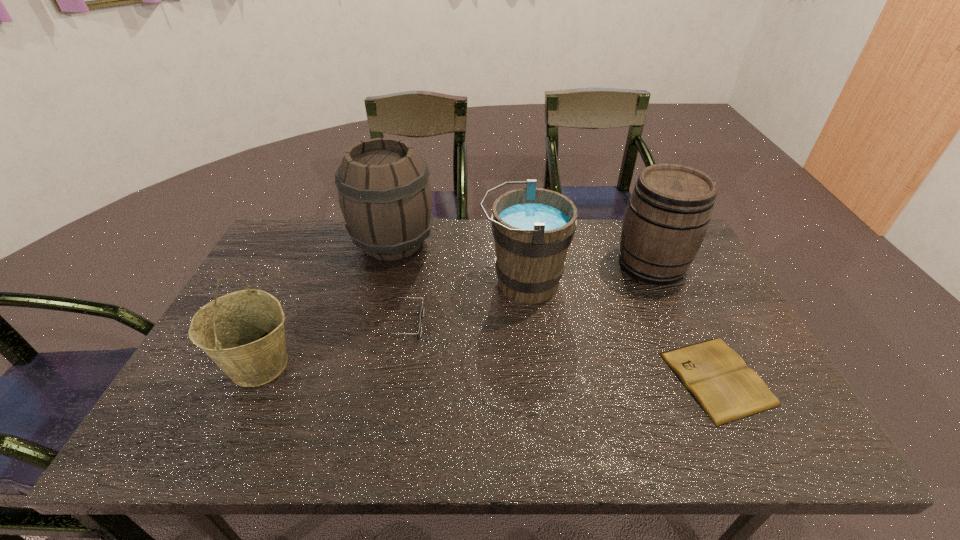
At what (x,y) coordinates should I click in order to perform the action: click on object that is at the near right corner. Please return your answer as a coordinate pair (x, y). Looking at the image, I should click on (718, 378).

Locate an element on the screen. Image resolution: width=960 pixels, height=540 pixels. vacant space at the far edge of the desktop is located at coordinates (467, 258).

What are the coordinates of `vacant space at the near edge of the desktop` in the screenshot? It's located at (398, 454).

In the image, there is a desktop. Identify the location of vacant space at the left edge. Image resolution: width=960 pixels, height=540 pixels. (244, 287).

In the image, there is a desktop. At what (x,y) coordinates should I click in order to perform the action: click on free space at the right edge. Please return your answer as a coordinate pair (x, y). The height and width of the screenshot is (540, 960). Looking at the image, I should click on (684, 298).

Where is `free region at the far left corner`? Image resolution: width=960 pixels, height=540 pixels. free region at the far left corner is located at coordinates (305, 246).

In order to click on free location at the near right corner of the desktop in this screenshot , I will do `click(788, 435)`.

At what (x,y) coordinates should I click in order to perform the action: click on free space between the shortest object and the rightmost wine bucket. Please return your answer as a coordinate pair (x, y). The width and height of the screenshot is (960, 540). Looking at the image, I should click on (684, 321).

Locate an element on the screen. This screenshot has width=960, height=540. blank region between the second shortest object and the leftmost object is located at coordinates (330, 344).

Identify the location of blank region between the book and the third wine bucket from right to left. The image size is (960, 540). (555, 310).